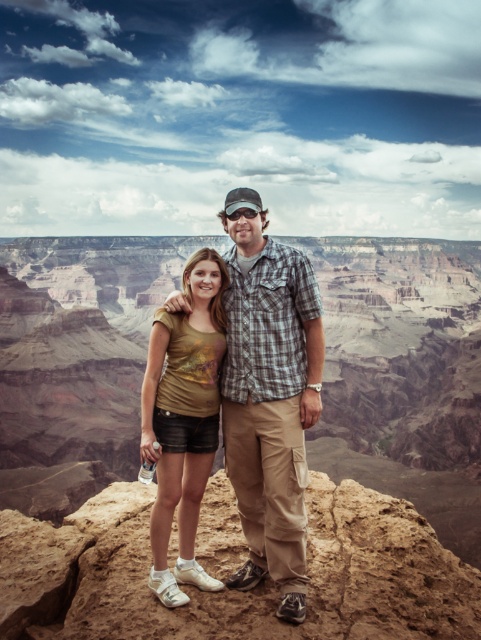
How much distance is there between matte gold shirt at center and gold metallic shirt at center?

They are 2.54 meters apart.

Can you confirm if matte gold shirt at center is bigger than gold metallic shirt at center?

Yes, matte gold shirt at center is bigger than gold metallic shirt at center.

Is point (288, 296) farther from viewer compared to point (194, 513)?

Yes, point (288, 296) is farther from viewer.

The height and width of the screenshot is (640, 481). I want to click on matte gold shirt at center, so click(x=269, y=396).